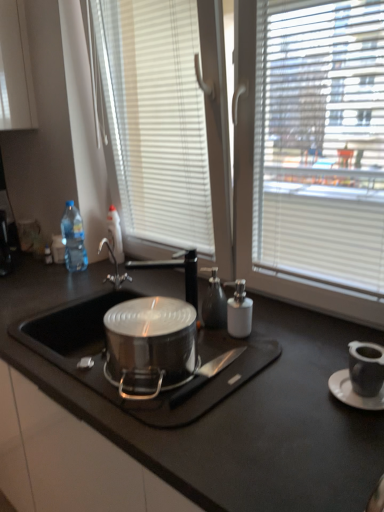
Image resolution: width=384 pixels, height=512 pixels. I want to click on free space behind black matte knife at center, so click(x=220, y=343).